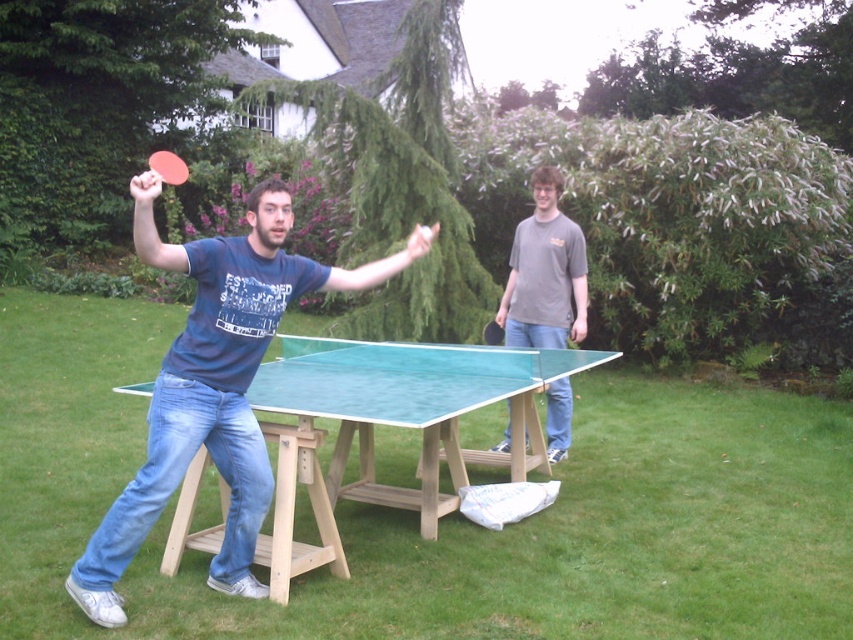
Question: Which of the following is the closest to the observer?

Choices:
 (A) (165, 150)
 (B) (135, 481)
 (C) (555, 385)

Answer: (B)

Question: Can you confirm if green matte table tennis table at center is wider than black rubber paddle at center?

Choices:
 (A) yes
 (B) no

Answer: (A)

Question: Which is nearer to the green wooden table at center?

Choices:
 (A) gray cotton t-shirt at center
 (B) matte blue t-shirt at center

Answer: (B)

Question: Can you confirm if matte blue t-shirt at center is positioned to the left of black rubber paddle at center?

Choices:
 (A) yes
 (B) no

Answer: (A)

Question: Observing the image, what is the correct spatial positioning of gray cotton t-shirt at center in reference to black rubber paddle at center?

Choices:
 (A) left
 (B) right

Answer: (B)

Question: Among these objects, which one is farthest from the camera?

Choices:
 (A) gray cotton t-shirt at center
 (B) black rubber paddle at center

Answer: (B)